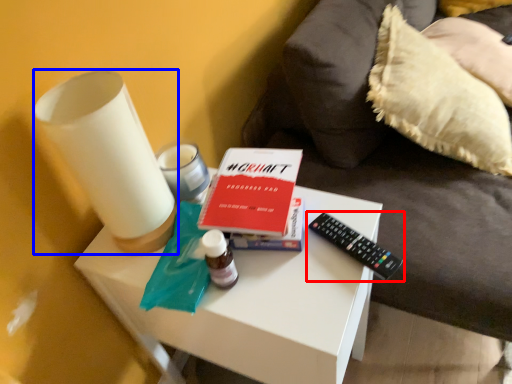
Question: Among these objects, which one is nearest to the camera, remote control (highlighted by a red box) or candle holder (highlighted by a blue box)?

Choices:
 (A) remote control
 (B) candle holder

Answer: (B)